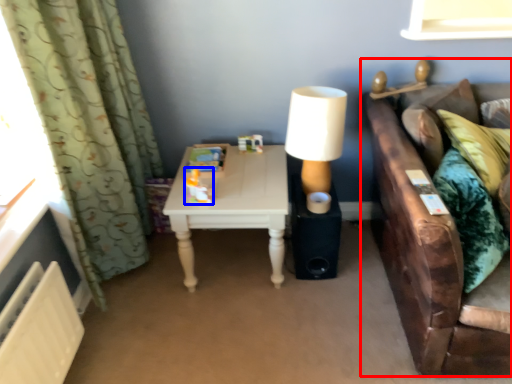
Question: Among these objects, which one is nearest to the camera, studio couch (highlighted by a red box) or toy (highlighted by a blue box)?

Choices:
 (A) studio couch
 (B) toy

Answer: (A)